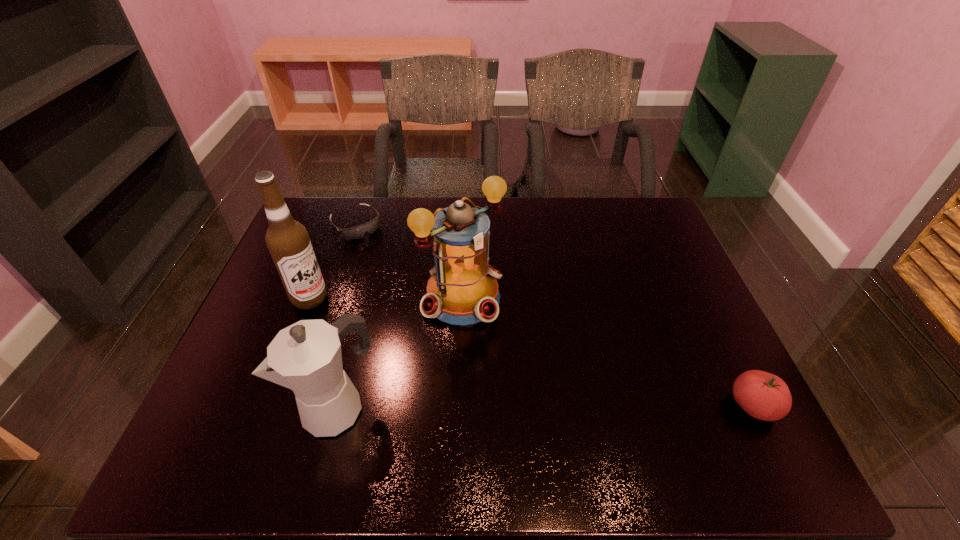
This screenshot has width=960, height=540. I want to click on free region at the far right corner of the desktop, so click(652, 203).

This screenshot has width=960, height=540. In order to click on free region at the near right corner in this screenshot , I will do `click(684, 396)`.

Locate an element on the screen. This screenshot has height=540, width=960. free space between the farthest object and the fourth object from left to right is located at coordinates (410, 260).

Where is `free space between the alcohol and the goggles`? free space between the alcohol and the goggles is located at coordinates (333, 261).

Image resolution: width=960 pixels, height=540 pixels. I want to click on free spot between the third tallest object and the lantern, so click(401, 352).

Where is `free space between the alcohol and the shortest object`? This screenshot has width=960, height=540. free space between the alcohol and the shortest object is located at coordinates (333, 261).

Locate an element on the screen. unoccupied area between the lantern and the shortest object is located at coordinates pos(410,260).

At what (x,y) coordinates should I click in order to perform the action: click on free area in between the farthest object and the lantern. Please return your answer as a coordinate pair (x, y). Looking at the image, I should click on (410, 260).

At what (x,y) coordinates should I click in order to perform the action: click on empty location between the shortest object and the alcohol. Please return your answer as a coordinate pair (x, y). This screenshot has width=960, height=540. Looking at the image, I should click on click(x=333, y=261).

Find the location of a particular element. This screenshot has width=960, height=540. free area in between the rightmost object and the coffeepot is located at coordinates (546, 406).